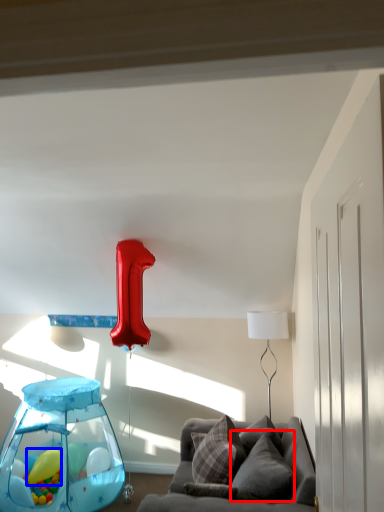
Question: Which of the following is the closest to the observer, pillow (highlighted by a red box) or balloon (highlighted by a blue box)?

Choices:
 (A) pillow
 (B) balloon

Answer: (A)